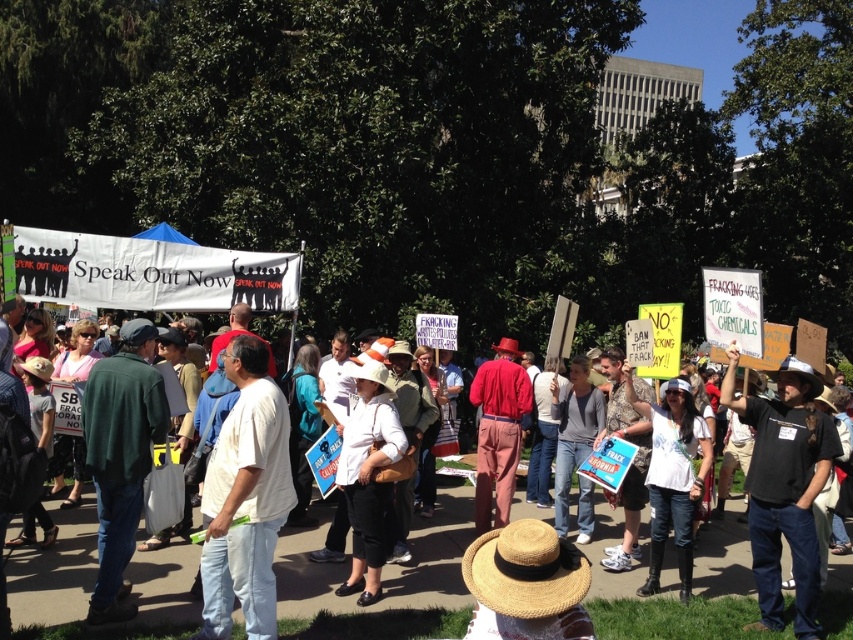
Measure the distance from white cotton shirt at center to black cotton shirt at center.

white cotton shirt at center and black cotton shirt at center are 4.10 meters apart.

Can you confirm if white cotton shirt at center is taller than black cotton shirt at center?

No.

Is point (241, 435) closer to viewer compared to point (799, 424)?

That is True.

Find the location of a particular element. This screenshot has width=853, height=640. white cotton shirt at center is located at coordinates click(245, 499).